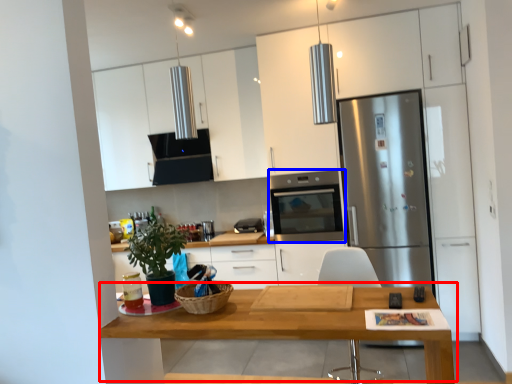
Question: Which object appears closest to the camera in this image, table (highlighted by a red box) or kitchen appliance (highlighted by a blue box)?

Choices:
 (A) table
 (B) kitchen appliance

Answer: (A)